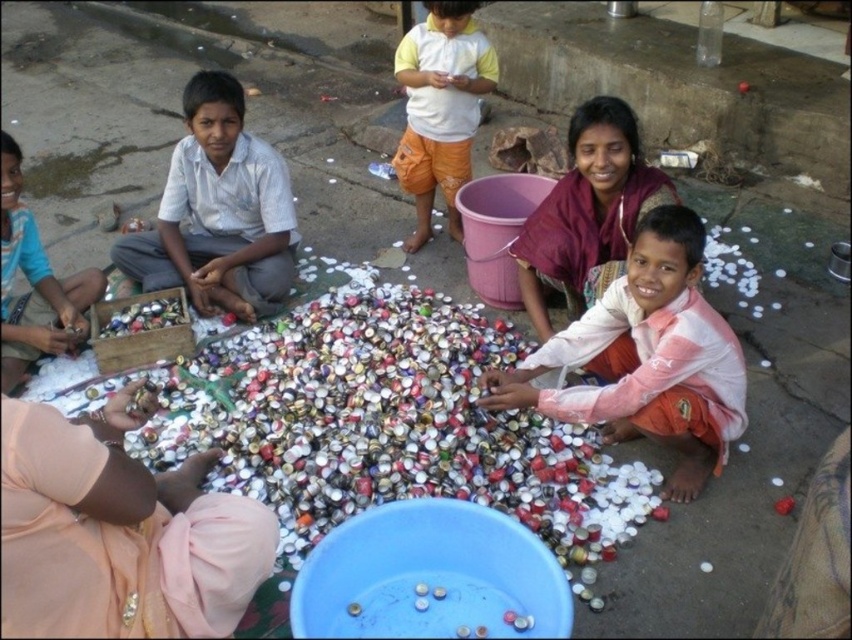
Question: Which point is closer to the camera?

Choices:
 (A) matte pink fabric at center
 (B) matte blue shirt at lower left

Answer: (A)

Question: Considering the relative positions of light gray cotton shirt at center and yellow cotton shirt at upper center in the image provided, where is light gray cotton shirt at center located with respect to yellow cotton shirt at upper center?

Choices:
 (A) right
 (B) left

Answer: (B)

Question: Is yellow cotton shirt at upper center above matte blue shirt at lower left?

Choices:
 (A) yes
 (B) no

Answer: (A)

Question: Which point is farther from the camera taking this photo?

Choices:
 (A) (609, 300)
 (B) (14, 186)
 (C) (544, 264)
 (D) (458, 17)

Answer: (D)

Question: Which point is closer to the camera taking this photo?

Choices:
 (A) (551, 230)
 (B) (574, 324)

Answer: (B)

Question: Can you confirm if pink fabric shirt at lower right is thinner than yellow cotton shirt at upper center?

Choices:
 (A) yes
 (B) no

Answer: (B)